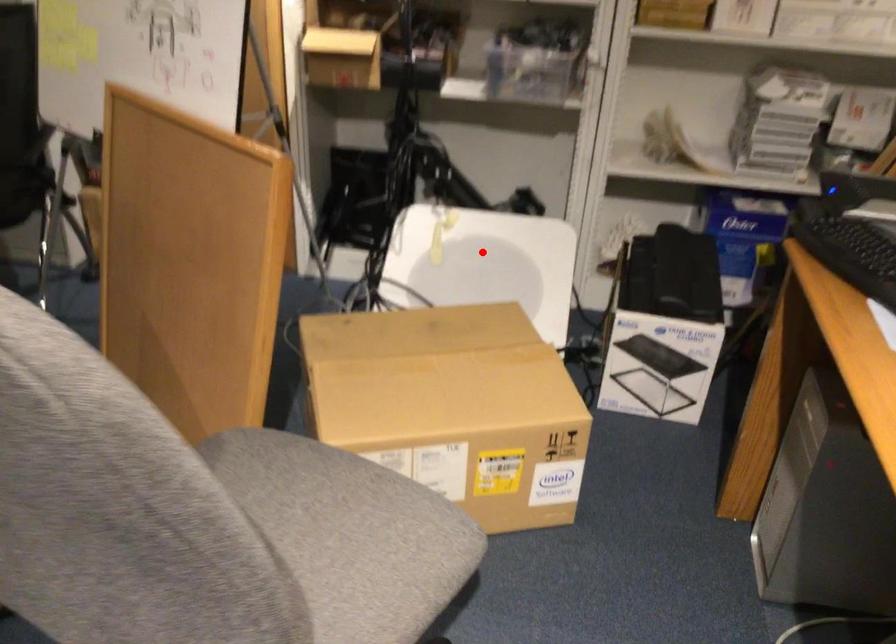
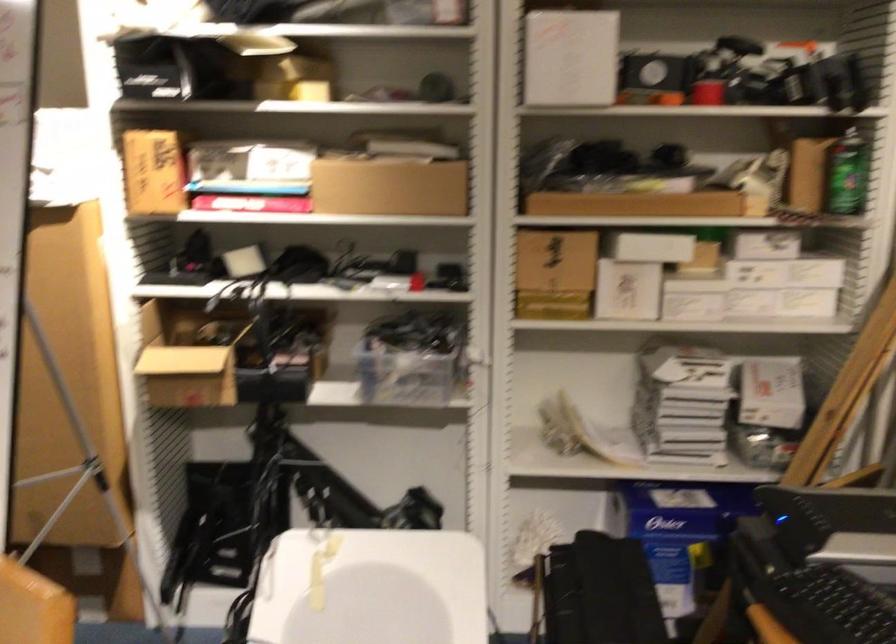
In the second image, find the point that corresponds to the highlighted location in the first image.

(371, 588)